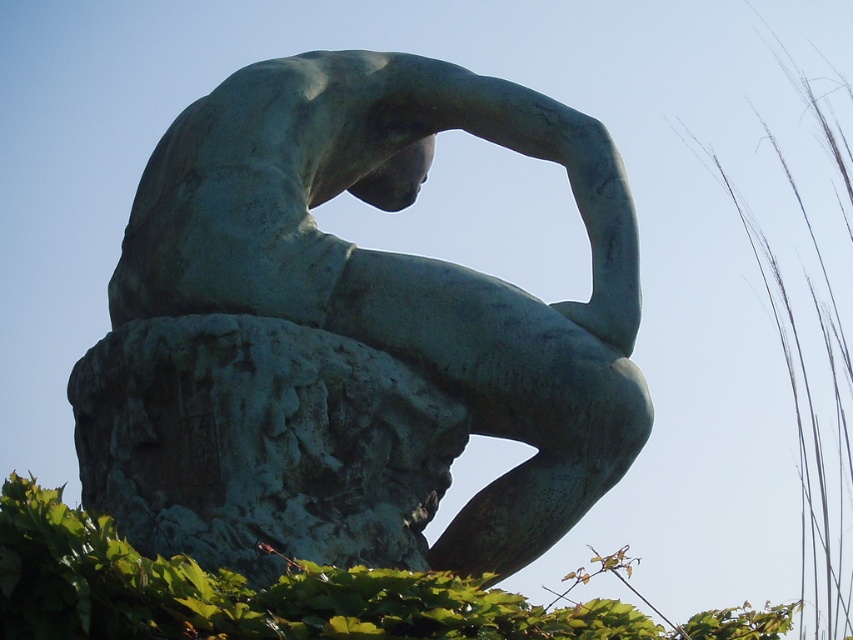
Is green patina stone sculpture at center shorter than green leafy hedge at lower left?

No.

Can you confirm if green patina stone sculpture at center is positioned to the right of green leafy hedge at lower left?

No, green patina stone sculpture at center is not to the right of green leafy hedge at lower left.

Does point (404, 442) come behind point (589, 625)?

That is True.

Image resolution: width=853 pixels, height=640 pixels. Identify the location of green patina stone sculpture at center. (350, 333).